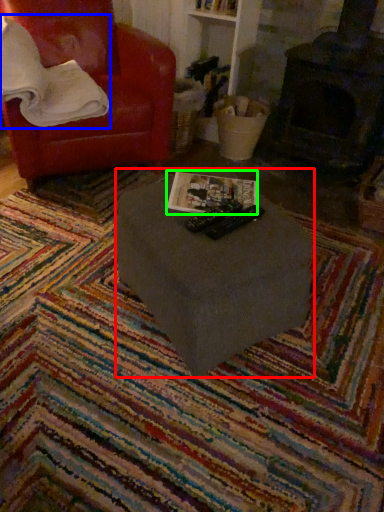
Question: Based on their relative distances, which object is farther from table (highlighted by a red box)? Choose from pillow (highlighted by a blue box) and magazine (highlighted by a green box).

Choices:
 (A) pillow
 (B) magazine

Answer: (A)